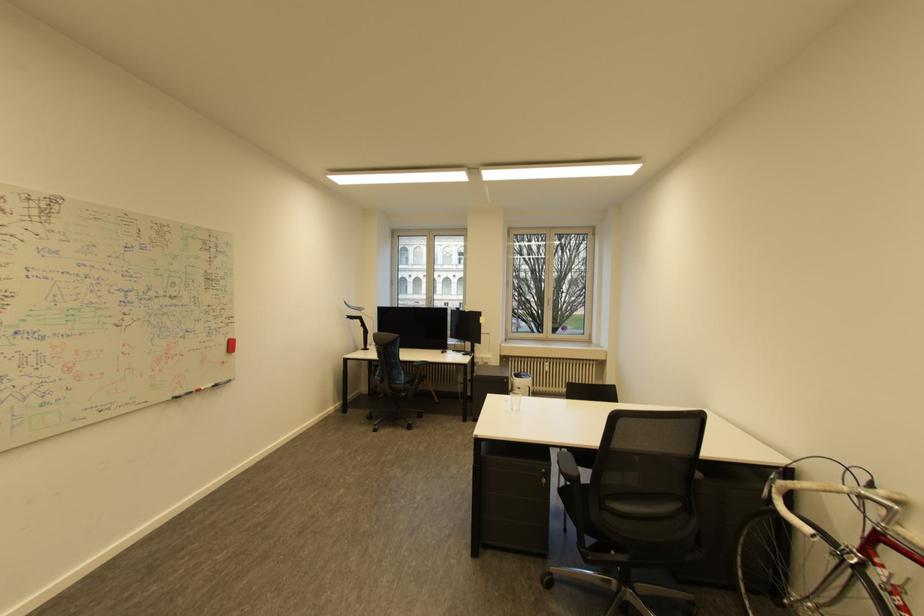
At what (x,y) coordinates should I click in order to perform the action: click on red whiteboard eraser. Please return your answer as a coordinate pair (x, y). This screenshot has height=616, width=924. Looking at the image, I should click on (229, 345).